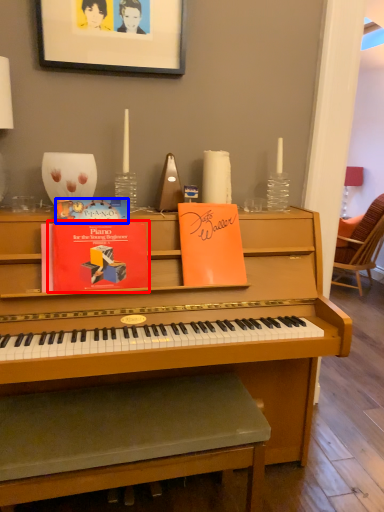
Question: Which object is closer to the camera taking this photo, paperback book (highlighted by a red box) or paperback book (highlighted by a blue box)?

Choices:
 (A) paperback book
 (B) paperback book

Answer: (A)